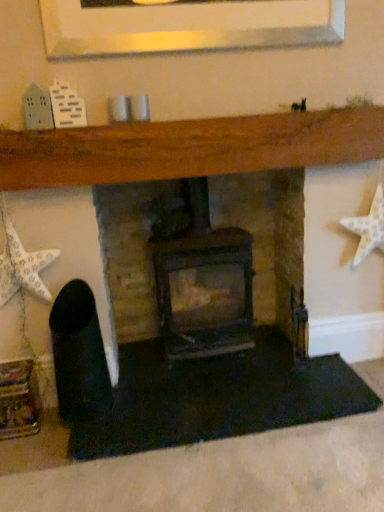
Question: Considering the relative positions of white matte starfish at right, the 2th starfish positioned from the left, and white paper star at left, the 1th starfish from the left, in the image provided, is white matte starfish at right, the 2th starfish positioned from the left, to the left of white paper star at left, the 1th starfish from the left, from the viewer's perspective?

Choices:
 (A) no
 (B) yes

Answer: (A)

Question: Are white matte starfish at right, the 2th starfish positioned from the left, and white paper star at left, which appears as the second starfish when viewed from the right, making contact?

Choices:
 (A) yes
 (B) no

Answer: (B)

Question: Could you tell me if white matte starfish at right, the 1th starfish from the right, is turned towards white paper star at left, which appears as the second starfish when viewed from the right?

Choices:
 (A) yes
 (B) no

Answer: (B)

Question: Is white matte starfish at right, the 2th starfish positioned from the left, far from white paper star at left, the 1th starfish from the left?

Choices:
 (A) yes
 (B) no

Answer: (A)

Question: From a real-world perspective, is white matte starfish at right, the 1th starfish from the right, located beneath white paper star at left, the 1th starfish from the left?

Choices:
 (A) yes
 (B) no

Answer: (A)

Question: In terms of height, does dark brown wood burning stove at center look taller or shorter compared to white paper star at left, which appears as the second starfish when viewed from the right?

Choices:
 (A) short
 (B) tall

Answer: (B)

Question: Looking at the image, does dark brown wood burning stove at center seem bigger or smaller compared to white paper star at left, which appears as the second starfish when viewed from the right?

Choices:
 (A) big
 (B) small

Answer: (A)

Question: In the image, is dark brown wood burning stove at center positioned in front of or behind white paper star at left, which appears as the second starfish when viewed from the right?

Choices:
 (A) front
 (B) behind

Answer: (B)

Question: Considering the positions of point pyautogui.click(x=226, y=313) and point pyautogui.click(x=23, y=251), is point pyautogui.click(x=226, y=313) closer or farther from the camera than point pyautogui.click(x=23, y=251)?

Choices:
 (A) closer
 (B) farther

Answer: (B)

Question: From the image's perspective, is dark brown wood burning stove at center positioned above or below white matte starfish at right, the 2th starfish positioned from the left?

Choices:
 (A) above
 (B) below

Answer: (B)

Question: Is point (236, 337) closer or farther from the camera than point (380, 218)?

Choices:
 (A) farther
 (B) closer

Answer: (A)

Question: Is dark brown wood burning stove at center taller or shorter than white matte starfish at right, the 2th starfish positioned from the left?

Choices:
 (A) tall
 (B) short

Answer: (A)

Question: From a real-world perspective, is dark brown wood burning stove at center physically located above or below white matte starfish at right, the 1th starfish from the right?

Choices:
 (A) above
 (B) below

Answer: (B)

Question: From a real-world perspective, is white matte starfish at right, the 2th starfish positioned from the left, positioned above or below white paper star at left, the 1th starfish from the left?

Choices:
 (A) above
 (B) below

Answer: (B)

Question: Is white matte starfish at right, the 2th starfish positioned from the left, in front of or behind white paper star at left, the 1th starfish from the left, in the image?

Choices:
 (A) behind
 (B) front

Answer: (A)